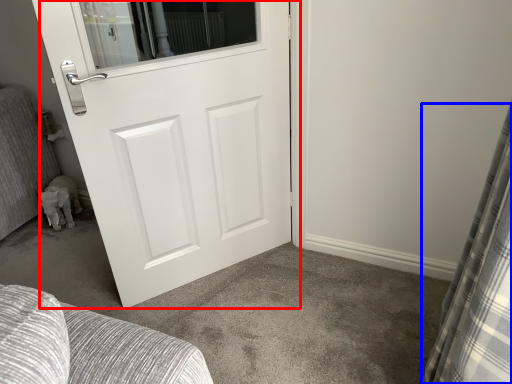
Question: Which object is further to the camera taking this photo, door (highlighted by a red box) or curtain (highlighted by a blue box)?

Choices:
 (A) door
 (B) curtain

Answer: (A)